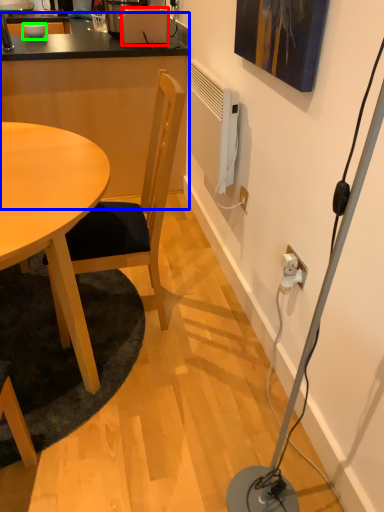
Question: Which object is positioned closest to toaster (highlighted by a red box)? Select from computer desk (highlighted by a blue box) and bowl (highlighted by a green box).

Choices:
 (A) computer desk
 (B) bowl

Answer: (A)